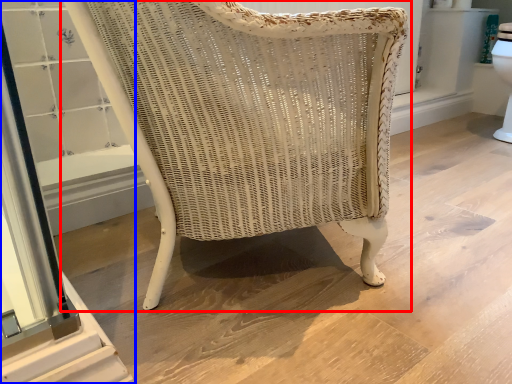
Question: Which point is further to the camera, chair (highlighted by a red box) or screen door (highlighted by a blue box)?

Choices:
 (A) chair
 (B) screen door

Answer: (B)